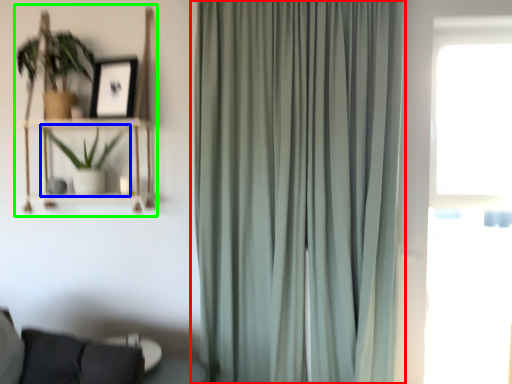
Question: Considering the real-world distances, which object is farthest from curtain (highlighted by a red box)? houseplant (highlighted by a blue box) or bookshelf (highlighted by a green box)?

Choices:
 (A) houseplant
 (B) bookshelf

Answer: (A)